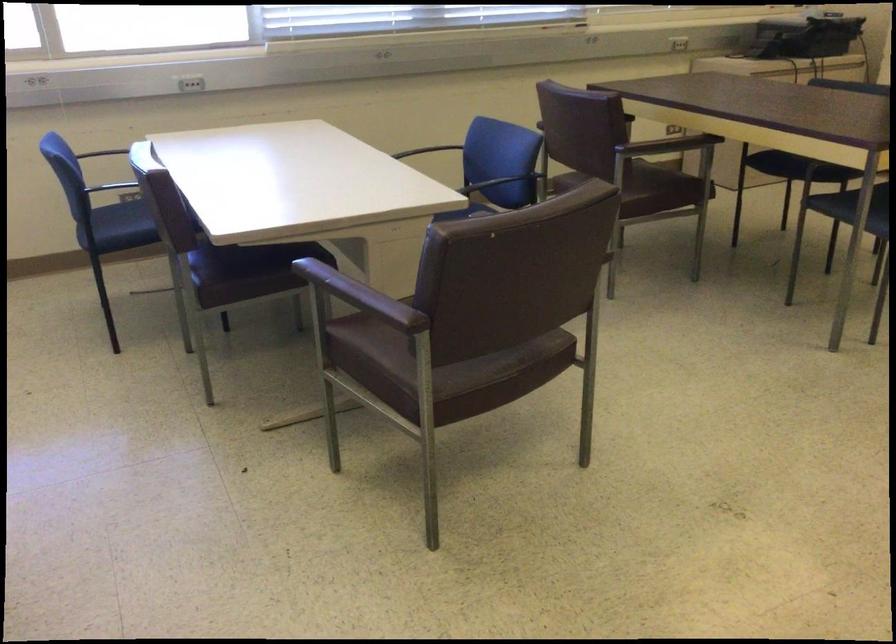
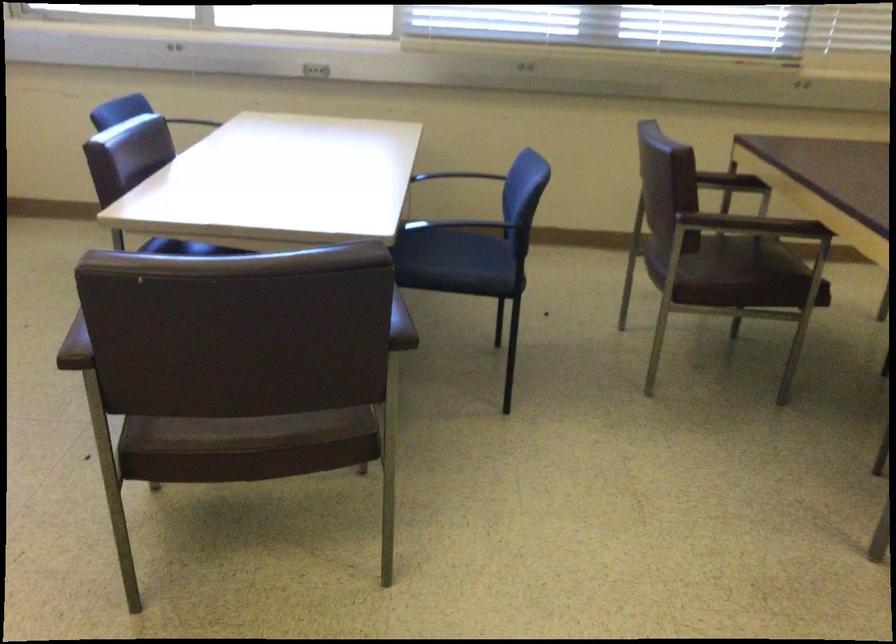
Which direction would the cameraman need to move to produce the second image?

The cameraman moved toward right, forward.